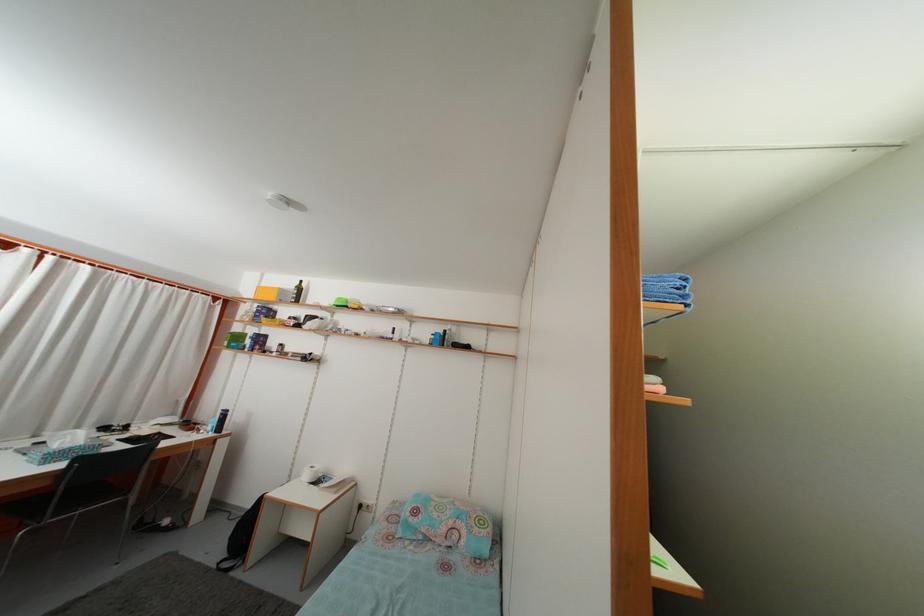
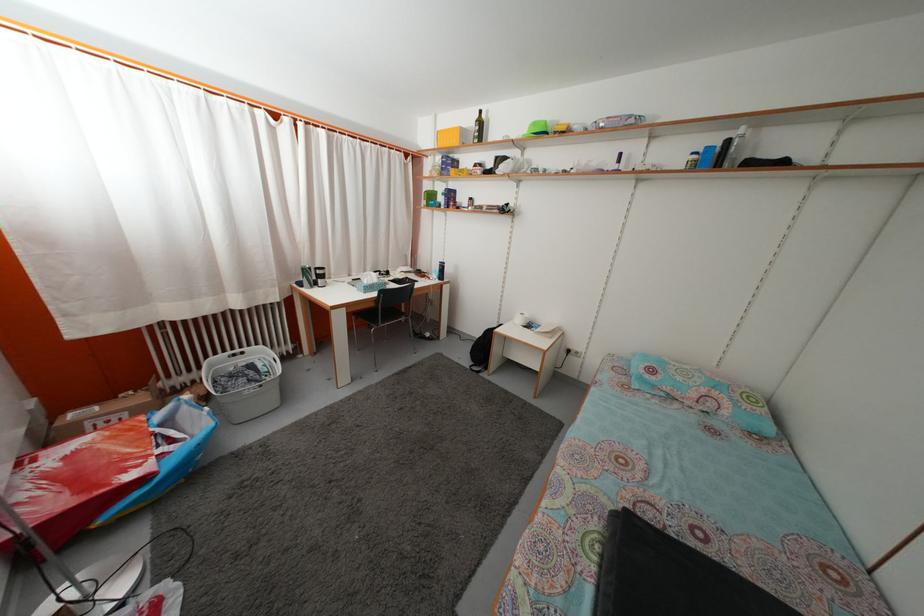
The point at (439, 344) is marked in the first image. Where is the corresponding point in the second image?

(699, 164)